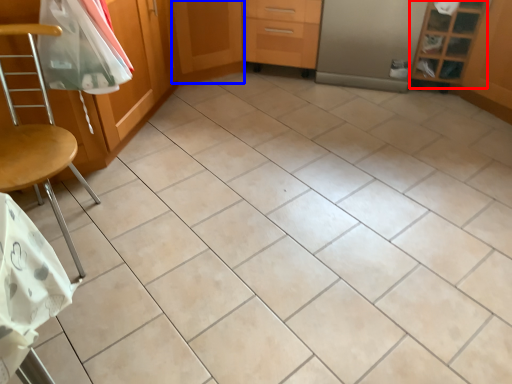
Question: Which of the following is the farthest to the observer, shelf (highlighted by a red box) or screen door (highlighted by a blue box)?

Choices:
 (A) shelf
 (B) screen door

Answer: (B)